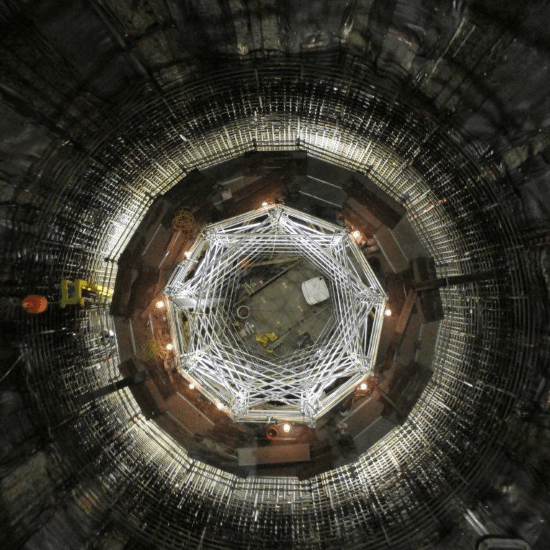
The width and height of the screenshot is (550, 550). Identify the location of concrete walls. (28, 154), (128, 67), (314, 33), (494, 95), (544, 289), (40, 533), (21, 430).